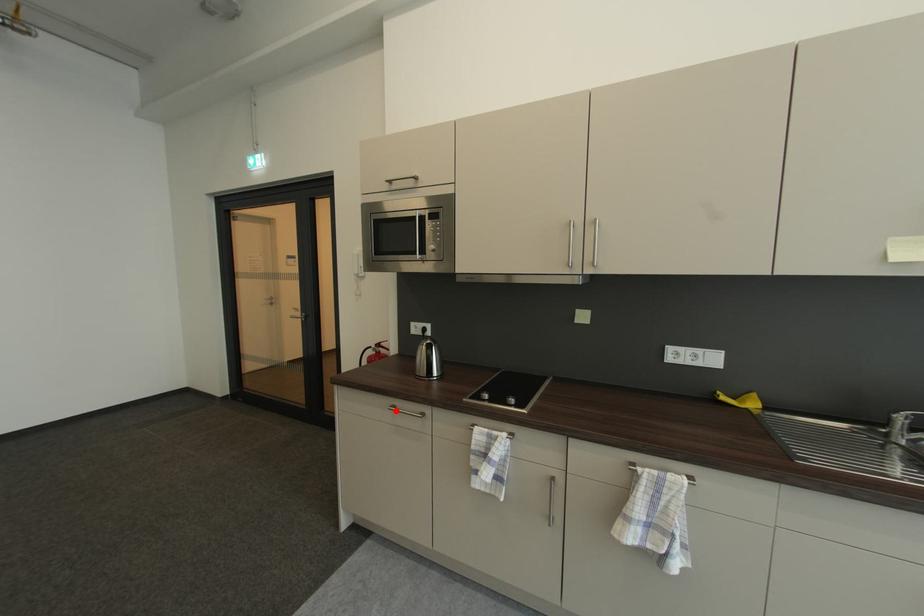
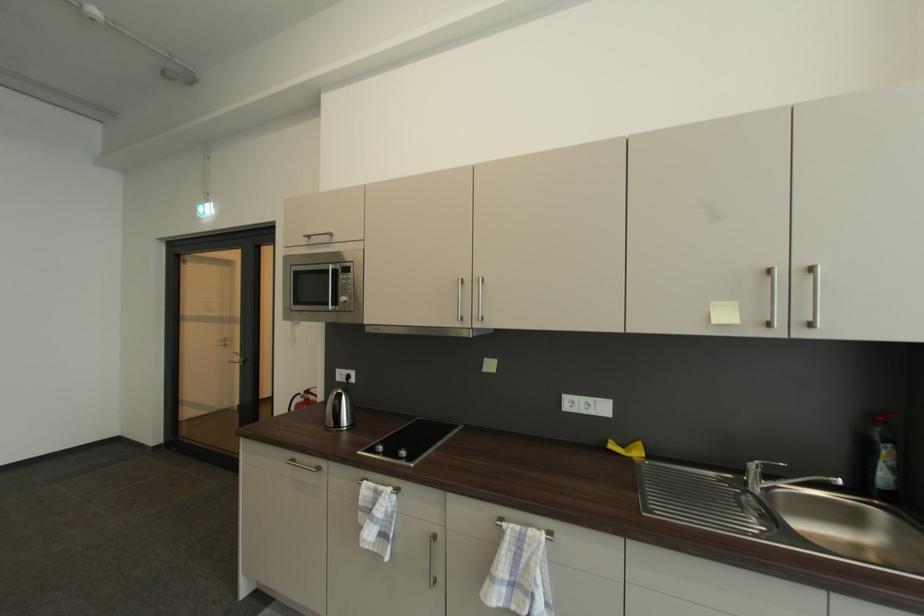
Question: I am providing you with two images of the same scene from different viewpoints. In image1, a red point is highlighted. Considering the same 3D point in image2, which of the following is correct?

Choices:
 (A) It is closer
 (B) It is farther

Answer: (B)